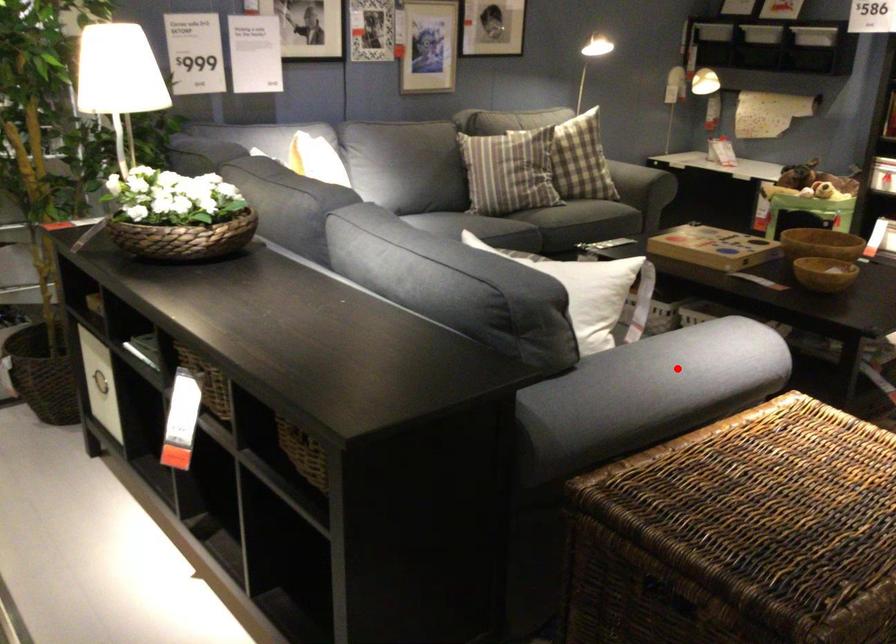
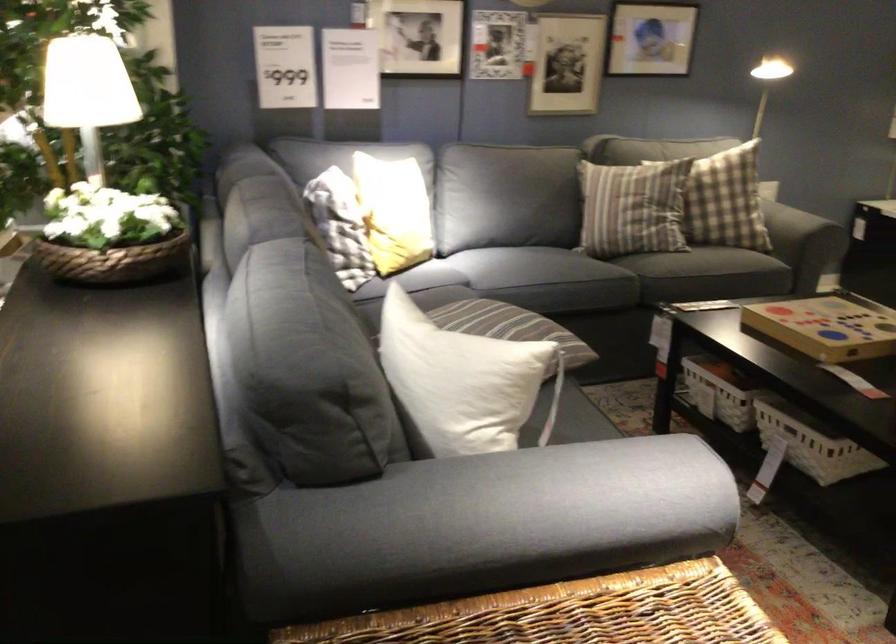
Question: I am providing you with two images of the same scene from different viewpoints. A red point is shown in image1. For the corresponding object point in image2, is it positioned nearer or farther from the camera?

Choices:
 (A) Nearer
 (B) Farther

Answer: (A)